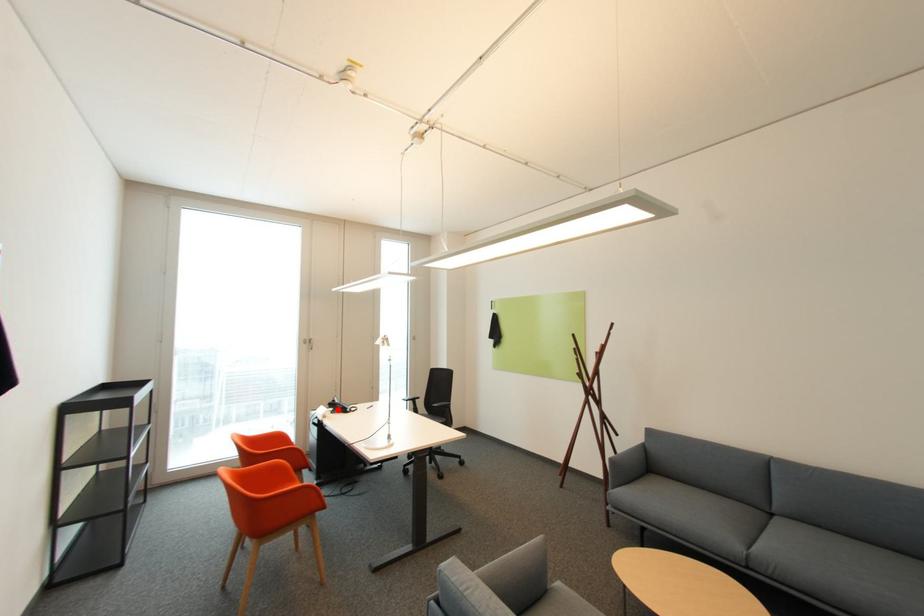
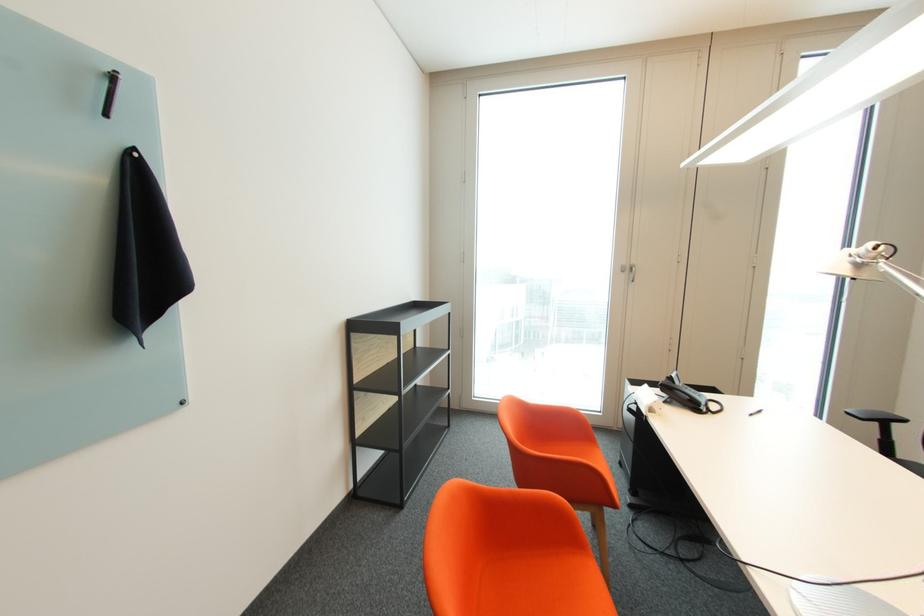
In the second image, find the point that corresponds to the highlighted location in the first image.

(673, 397)